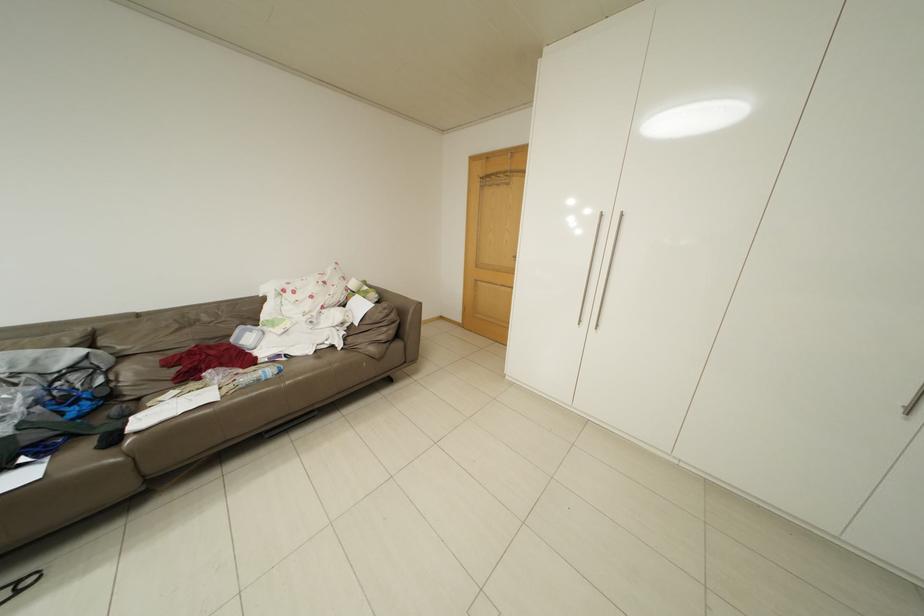
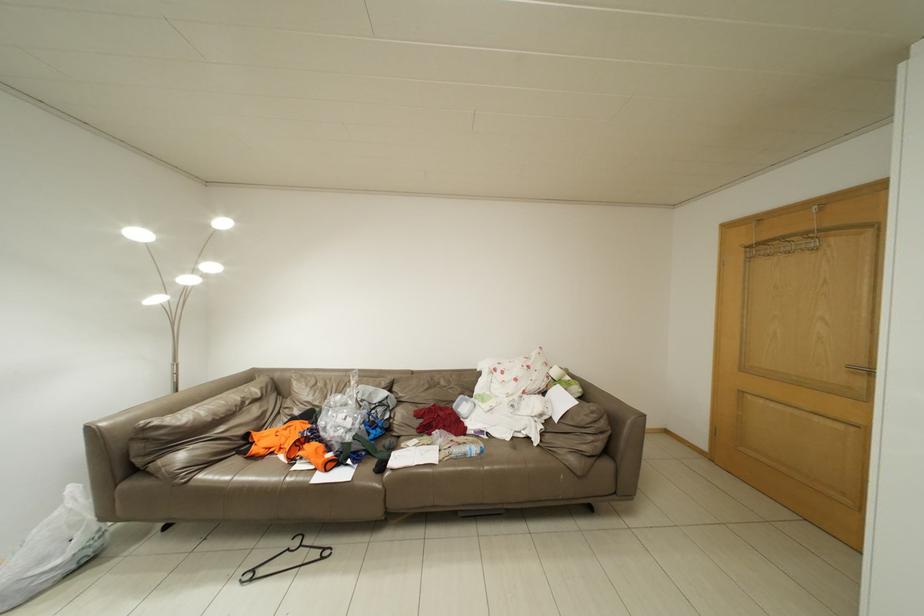
Question: The first image is from the beginning of the video and the second image is from the end. How did the camera likely rotate when shooting the video?

Choices:
 (A) Left
 (B) Right
 (C) Up
 (D) Down

Answer: (A)